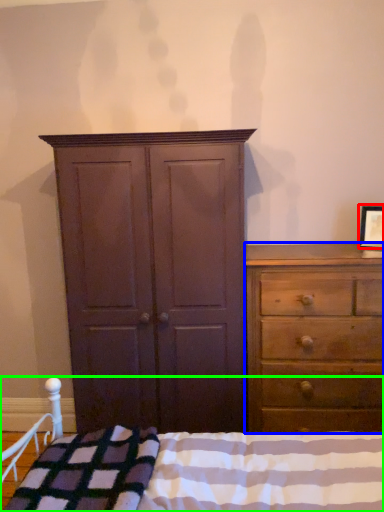
Question: Which object is positioned farthest from picture frame (highlighted by a red box)? Select from chest of drawers (highlighted by a blue box) and bed (highlighted by a green box).

Choices:
 (A) chest of drawers
 (B) bed

Answer: (B)